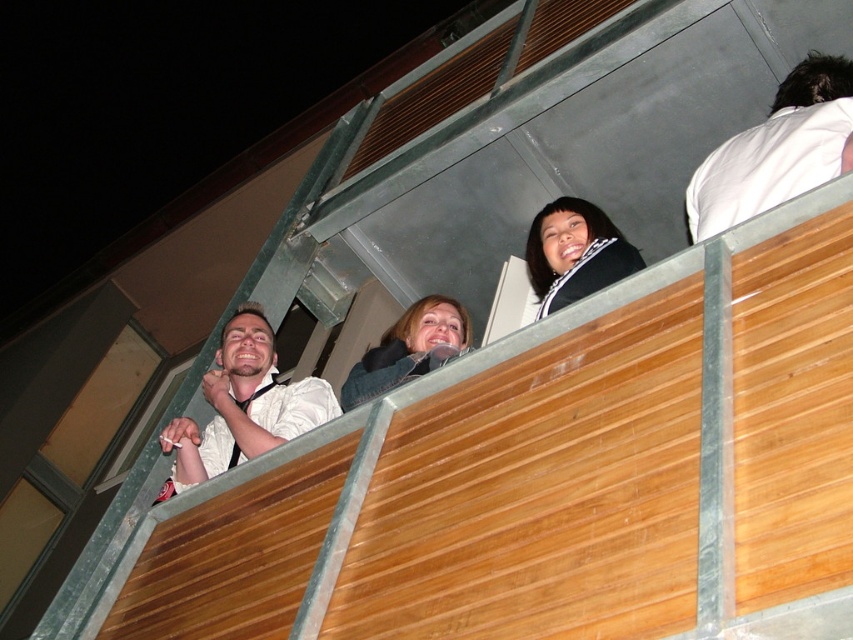
You are a photographer trying to capture a closeup of the black satin scarf at upper center without including the white matte shirt at left in the frame. Given their sizes, which object should you focus on to ensure the scarf is centered and the shirt is out of the shot?

The white matte shirt at left is larger in size than the black satin scarf at upper center. To center the scarf and exclude the shirt, focus on the smaller black satin scarf at upper center since it takes up less space in the frame.